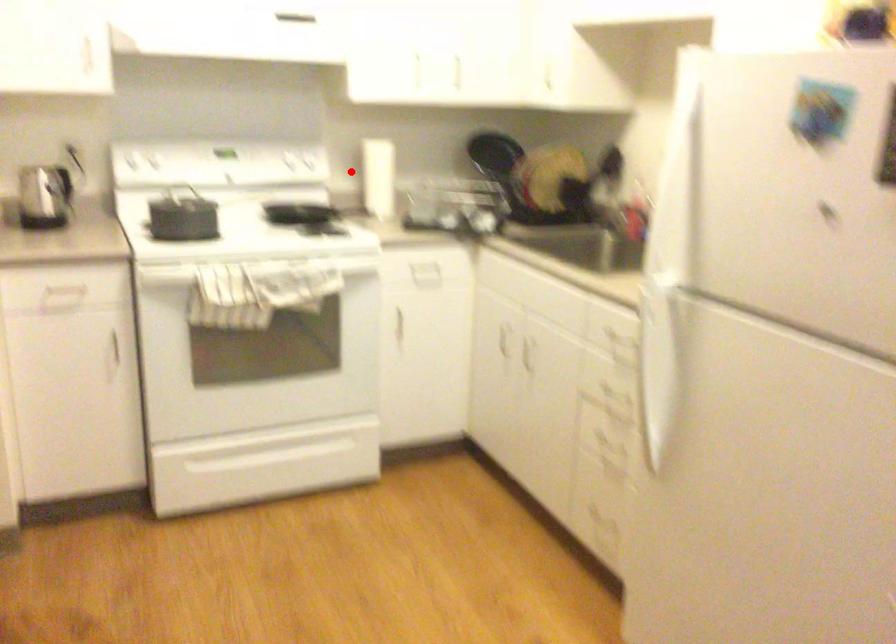
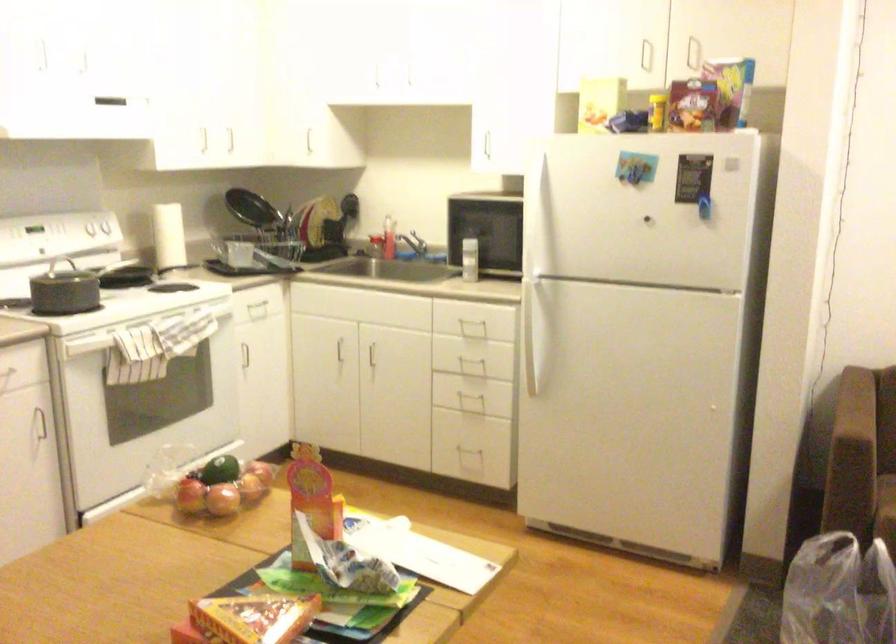
Find the pixel in the second image that matches the highlighted location in the first image.

(168, 236)